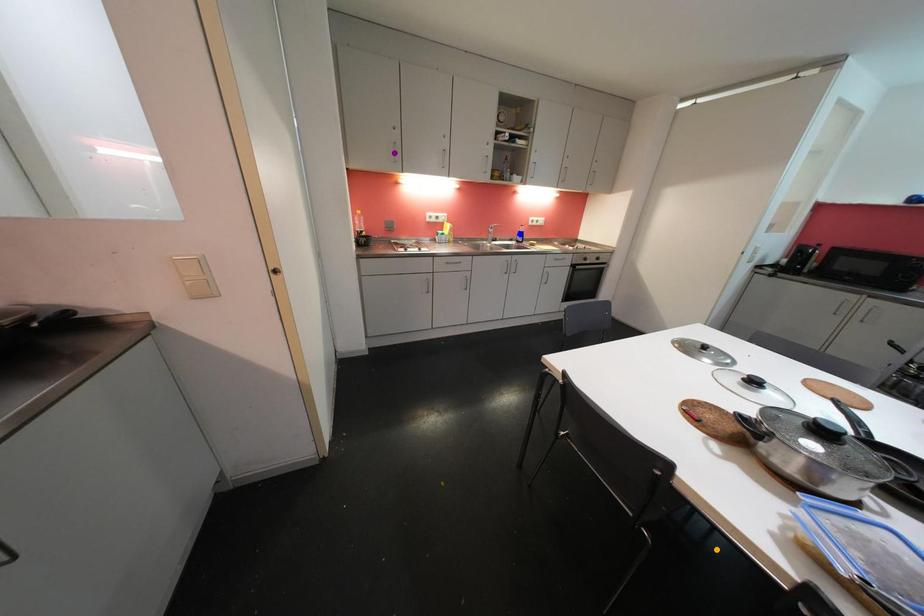
Order these from nearest to farthest:
blue point
purple point
orange point

orange point → purple point → blue point